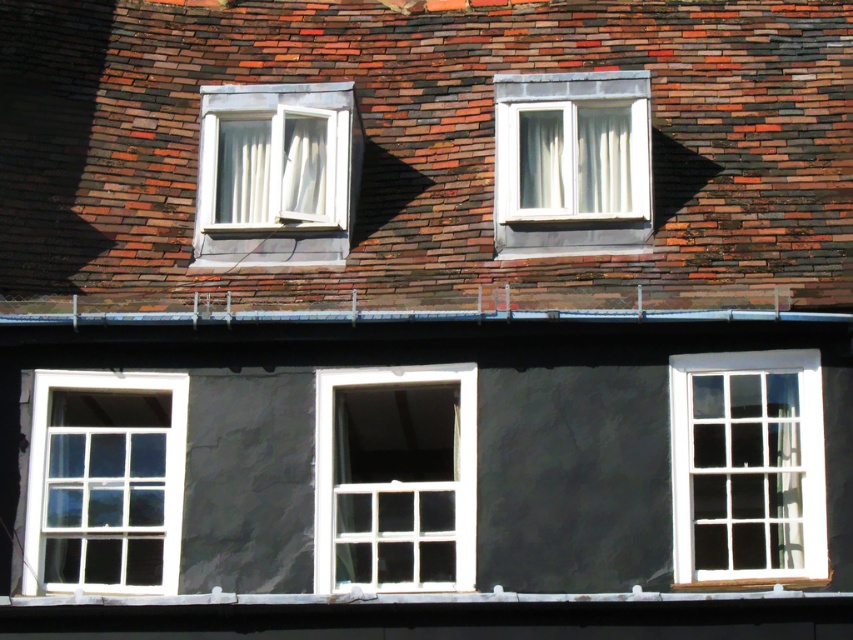
Question: Can you confirm if white wooden window at center is positioned below white sheer curtain at upper left?

Choices:
 (A) yes
 (B) no

Answer: (A)

Question: Does brown shingles at upper center appear on the right side of white wooden window at center?

Choices:
 (A) yes
 (B) no

Answer: (A)

Question: Which of the following is the closest to the observer?

Choices:
 (A) white sheer curtain at upper right
 (B) white wooden window at right
 (C) white sheer curtain at upper left
 (D) white glass window at left

Answer: (B)

Question: Which point is farther from the camera taking this photo?

Choices:
 (A) (294, 157)
 (B) (128, 438)

Answer: (A)

Question: Is white wooden window at center closer to the viewer compared to white plastic window at upper center?

Choices:
 (A) yes
 (B) no

Answer: (A)

Question: Based on their relative distances, which object is farther from the white wood window at upper center?

Choices:
 (A) white sheer curtain at upper left
 (B) white plastic window at upper center
 (C) brown shingles at upper center
 (D) white glass window at left

Answer: (D)